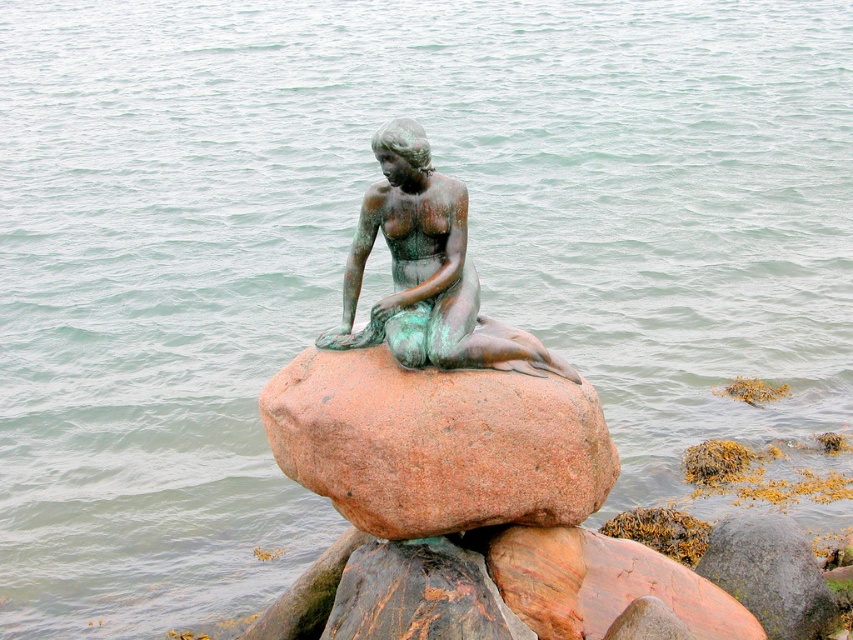
You are a photographer standing in front of the statue. You want to take a photo that includes both the point at the mermaid statue located at point (412, 176) and the point at the rock located at point (325, 429). Which point should you focus on first to ensure both are in sharp focus?

You should focus on point (412, 176) first since it is closer to the camera than point (325, 429). This ensures that both points will be within the depth of field and appear sharp in the photo.